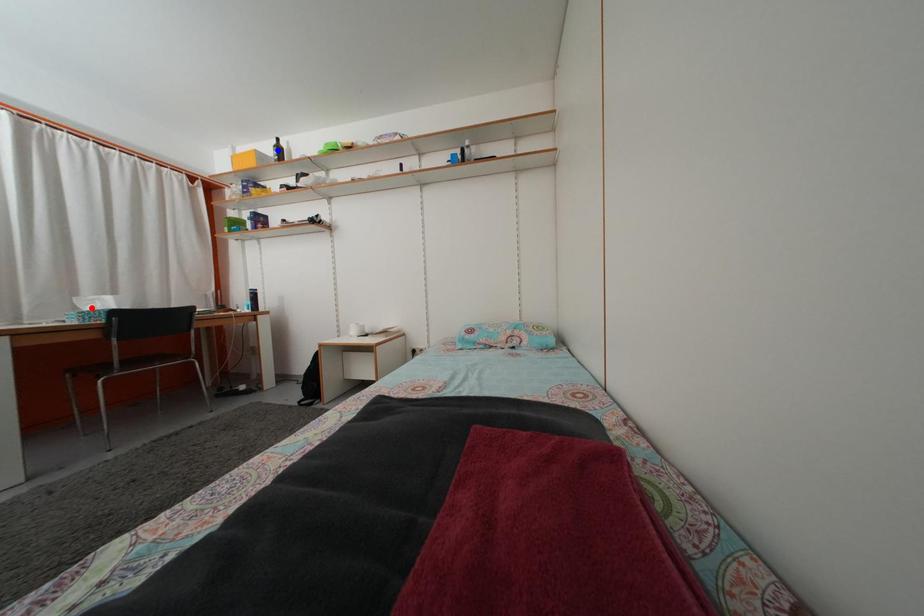
Question: Which of the two points in the image is closer to the camera?

Choices:
 (A) Blue point is closer.
 (B) Red point is closer.

Answer: (B)